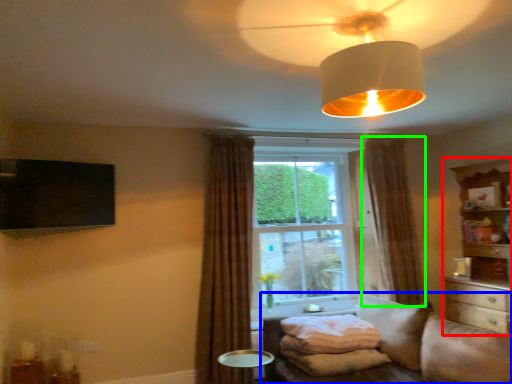
Question: Based on their relative distances, which object is farther from entertainment center (highlighted by a red box)? Choose from studio couch (highlighted by a blue box) and curtain (highlighted by a green box).

Choices:
 (A) studio couch
 (B) curtain

Answer: (A)